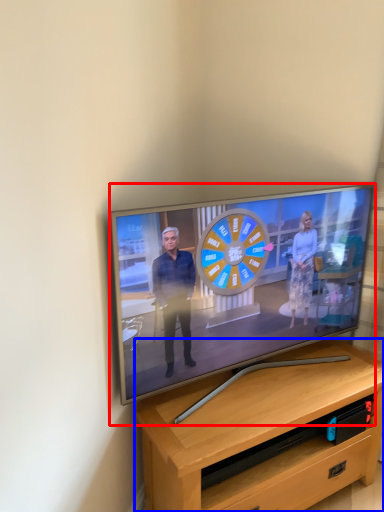
Question: Which object appears closest to the camera in this image, television (highlighted by a red box) or desk (highlighted by a blue box)?

Choices:
 (A) television
 (B) desk

Answer: (A)